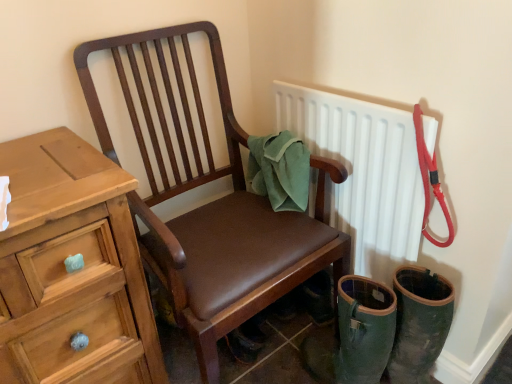
Question: Is green fabric towel at chair back at the back of wooden chest of drawers at left?

Choices:
 (A) no
 (B) yes

Answer: (A)

Question: Is there a large distance between wooden chest of drawers at left and green fabric towel at chair back?

Choices:
 (A) yes
 (B) no

Answer: (B)

Question: Considering the relative positions of wooden chest of drawers at left and green fabric towel at chair back in the image provided, is wooden chest of drawers at left to the left of green fabric towel at chair back from the viewer's perspective?

Choices:
 (A) yes
 (B) no

Answer: (A)

Question: Is wooden chest of drawers at left taller than green fabric towel at chair back?

Choices:
 (A) yes
 (B) no

Answer: (A)

Question: From a real-world perspective, is wooden chest of drawers at left over green fabric towel at chair back?

Choices:
 (A) no
 (B) yes

Answer: (A)

Question: Is wooden chest of drawers at left oriented towards green fabric towel at chair back?

Choices:
 (A) no
 (B) yes

Answer: (A)

Question: Is wooden chest of drawers at left next to brown leather chair at center and touching it?

Choices:
 (A) no
 (B) yes

Answer: (A)

Question: Considering the relative sizes of wooden chest of drawers at left and brown leather chair at center in the image provided, is wooden chest of drawers at left thinner than brown leather chair at center?

Choices:
 (A) no
 (B) yes

Answer: (B)

Question: From the image's perspective, is wooden chest of drawers at left located above brown leather chair at center?

Choices:
 (A) no
 (B) yes

Answer: (A)

Question: Considering the relative positions of wooden chest of drawers at left and brown leather chair at center in the image provided, is wooden chest of drawers at left to the right of brown leather chair at center from the viewer's perspective?

Choices:
 (A) yes
 (B) no

Answer: (B)

Question: Does wooden chest of drawers at left have a greater height compared to brown leather chair at center?

Choices:
 (A) yes
 (B) no

Answer: (B)

Question: Is wooden chest of drawers at left to the left of brown leather chair at center from the viewer's perspective?

Choices:
 (A) no
 (B) yes

Answer: (B)

Question: Is brown leather chair at center aimed at white matte radiator at upper right?

Choices:
 (A) yes
 (B) no

Answer: (B)